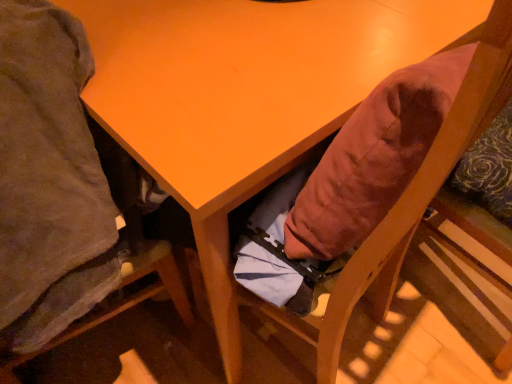
What do you see at coordinates (415, 193) in the screenshot? The height and width of the screenshot is (384, 512). I see `velvet-like orange cushion at lower right, the second chair positioned from the left` at bounding box center [415, 193].

At what (x,y) coordinates should I click in order to perform the action: click on velvet-like orange cushion at lower right, the 1th chair from the right. Please return your answer as a coordinate pair (x, y). The height and width of the screenshot is (384, 512). Looking at the image, I should click on (415, 193).

Identify the location of wooden chair at lower left, which appears as the first chair when viewed from the left. (57, 185).

What do you see at coordinates (57, 185) in the screenshot? I see `wooden chair at lower left, acting as the 2th chair starting from the right` at bounding box center [57, 185].

You are a GUI agent. You are given a task and a screenshot of the screen. Output one action in this format:
    pyautogui.click(x=<x>, y=<y>)
    Task: Click on the velvet-like orange cushion at lower right, the 1th chair from the right
    The width and height of the screenshot is (512, 384).
    Given the screenshot: What is the action you would take?
    point(415,193)

Between wooden chair at lower left, acting as the 2th chair starting from the right, and velvet-like orange cushion at lower right, the second chair positioned from the left, which one appears on the left side from the viewer's perspective?

Positioned to the left is wooden chair at lower left, acting as the 2th chair starting from the right.

Does wooden chair at lower left, which appears as the first chair when viewed from the left, come behind velvet-like orange cushion at lower right, the 1th chair from the right?

That is False.

Does point (34, 222) come behind point (494, 61)?

Yes, it is behind point (494, 61).

From the image's perspective, is wooden chair at lower left, acting as the 2th chair starting from the right, under velvet-like orange cushion at lower right, the 1th chair from the right?

Yes.

From a real-world perspective, which object rests below the other?

In real-world perspective, wooden chair at lower left, which appears as the first chair when viewed from the left, is lower.

Considering the relative sizes of wooden chair at lower left, which appears as the first chair when viewed from the left, and velvet-like orange cushion at lower right, the second chair positioned from the left, in the image provided, is wooden chair at lower left, which appears as the first chair when viewed from the left, wider than velvet-like orange cushion at lower right, the second chair positioned from the left,?

Yes, wooden chair at lower left, which appears as the first chair when viewed from the left, is wider than velvet-like orange cushion at lower right, the second chair positioned from the left.

Is wooden chair at lower left, acting as the 2th chair starting from the right, taller than velvet-like orange cushion at lower right, the 1th chair from the right?

Correct, wooden chair at lower left, acting as the 2th chair starting from the right, is much taller as velvet-like orange cushion at lower right, the 1th chair from the right.

Between wooden chair at lower left, which appears as the first chair when viewed from the left, and velvet-like orange cushion at lower right, the 1th chair from the right, which one has larger size?

Bigger between the two is wooden chair at lower left, which appears as the first chair when viewed from the left.

Is wooden chair at lower left, acting as the 2th chair starting from the right, situated inside velvet-like orange cushion at lower right, the 1th chair from the right, or outside?

wooden chair at lower left, acting as the 2th chair starting from the right, lies outside velvet-like orange cushion at lower right, the 1th chair from the right.

Is wooden chair at lower left, which appears as the first chair when viewed from the left, touching velvet-like orange cushion at lower right, the second chair positioned from the left?

No, wooden chair at lower left, which appears as the first chair when viewed from the left, is not with velvet-like orange cushion at lower right, the second chair positioned from the left.

Is wooden chair at lower left, which appears as the first chair when viewed from the left, oriented towards velvet-like orange cushion at lower right, the second chair positioned from the left?

No, wooden chair at lower left, which appears as the first chair when viewed from the left, is not aimed at velvet-like orange cushion at lower right, the second chair positioned from the left.

Locate an element on the screen. chair above the wooden chair at lower left, which appears as the first chair when viewed from the left (from a real-world perspective) is located at coordinates (415, 193).

Which is more to the right, velvet-like orange cushion at lower right, the 1th chair from the right, or wooden chair at lower left, which appears as the first chair when viewed from the left?

velvet-like orange cushion at lower right, the 1th chair from the right, is more to the right.

Between velvet-like orange cushion at lower right, the second chair positioned from the left, and wooden chair at lower left, which appears as the first chair when viewed from the left, which one is positioned in front?

Positioned in front is wooden chair at lower left, which appears as the first chair when viewed from the left.

Between point (506, 244) and point (104, 202), which one is positioned behind?

Point (506, 244)

From the image's perspective, between velvet-like orange cushion at lower right, the 1th chair from the right, and wooden chair at lower left, acting as the 2th chair starting from the right, who is located below?

From the image's view, wooden chair at lower left, acting as the 2th chair starting from the right, is below.

From a real-world perspective, is velvet-like orange cushion at lower right, the 1th chair from the right, above or below wooden chair at lower left, acting as the 2th chair starting from the right?

From a real-world perspective, velvet-like orange cushion at lower right, the 1th chair from the right, is physically above wooden chair at lower left, acting as the 2th chair starting from the right.

Considering the relative sizes of velvet-like orange cushion at lower right, the 1th chair from the right, and wooden chair at lower left, which appears as the first chair when viewed from the left, in the image provided, is velvet-like orange cushion at lower right, the 1th chair from the right, thinner than wooden chair at lower left, which appears as the first chair when viewed from the left,?

Yes, velvet-like orange cushion at lower right, the 1th chair from the right, is thinner than wooden chair at lower left, which appears as the first chair when viewed from the left.

Does velvet-like orange cushion at lower right, the second chair positioned from the left, have a lesser height compared to wooden chair at lower left, acting as the 2th chair starting from the right?

Correct, velvet-like orange cushion at lower right, the second chair positioned from the left, is not as tall as wooden chair at lower left, acting as the 2th chair starting from the right.

Considering the relative sizes of velvet-like orange cushion at lower right, the second chair positioned from the left, and wooden chair at lower left, acting as the 2th chair starting from the right, in the image provided, is velvet-like orange cushion at lower right, the second chair positioned from the left, smaller than wooden chair at lower left, acting as the 2th chair starting from the right,?

Indeed, velvet-like orange cushion at lower right, the second chair positioned from the left, has a smaller size compared to wooden chair at lower left, acting as the 2th chair starting from the right.

Is wooden chair at lower left, which appears as the first chair when viewed from the left, completely or partially inside velvet-like orange cushion at lower right, the 1th chair from the right?

Actually, wooden chair at lower left, which appears as the first chair when viewed from the left, is outside velvet-like orange cushion at lower right, the 1th chair from the right.

Is velvet-like orange cushion at lower right, the 1th chair from the right, in contact with wooden chair at lower left, which appears as the first chair when viewed from the left?

velvet-like orange cushion at lower right, the 1th chair from the right, and wooden chair at lower left, which appears as the first chair when viewed from the left, are clearly separated.

Consider the image. Is velvet-like orange cushion at lower right, the 1th chair from the right, oriented away from wooden chair at lower left, acting as the 2th chair starting from the right?

No, velvet-like orange cushion at lower right, the 1th chair from the right, is not facing away from wooden chair at lower left, acting as the 2th chair starting from the right.

How many degrees apart are the facing directions of velvet-like orange cushion at lower right, the second chair positioned from the left, and wooden chair at lower left, which appears as the first chair when viewed from the left?

The angle between the facing direction of velvet-like orange cushion at lower right, the second chair positioned from the left, and the facing direction of wooden chair at lower left, which appears as the first chair when viewed from the left, is 92.1 degrees.

Could you measure the distance between velvet-like orange cushion at lower right, the second chair positioned from the left, and wooden chair at lower left, acting as the 2th chair starting from the right?

velvet-like orange cushion at lower right, the second chair positioned from the left, is 17.74 inches from wooden chair at lower left, acting as the 2th chair starting from the right.

The height and width of the screenshot is (384, 512). Find the location of `chair below the velvet-like orange cushion at lower right, the second chair positioned from the left (from the image's perspective)`. chair below the velvet-like orange cushion at lower right, the second chair positioned from the left (from the image's perspective) is located at coordinates point(57,185).

This screenshot has height=384, width=512. What are the coordinates of `chair above the wooden chair at lower left, which appears as the first chair when viewed from the left (from a real-world perspective)` in the screenshot? It's located at (415, 193).

Locate an element on the screen. This screenshot has height=384, width=512. chair above the wooden chair at lower left, which appears as the first chair when viewed from the left (from the image's perspective) is located at coordinates (415, 193).